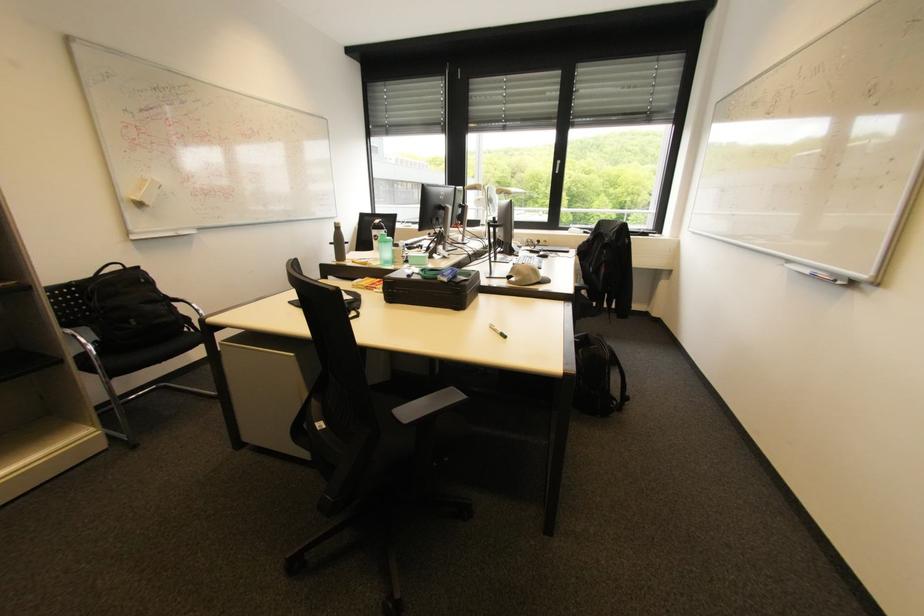
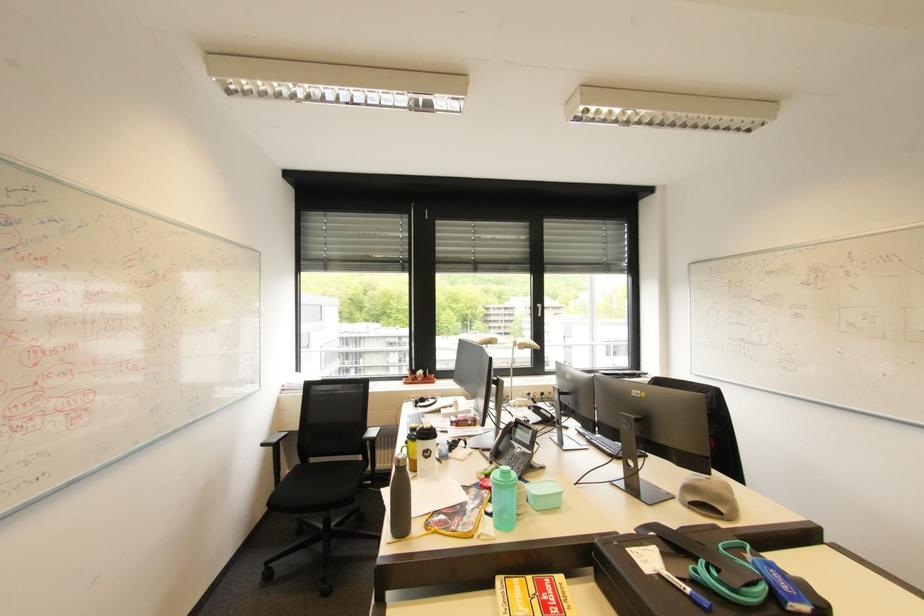
Where in the second image is the point corresponding to point (419, 273) from the first image?

(685, 581)